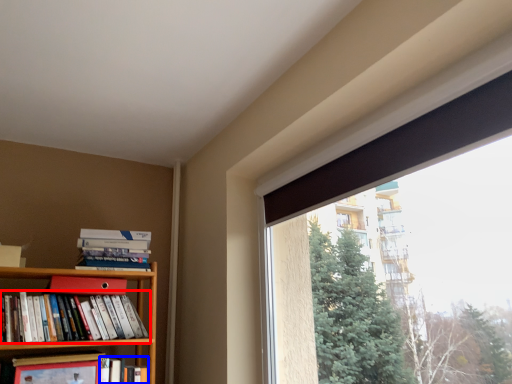
Question: Which object appears closest to the camera in this image, book (highlighted by a red box) or book (highlighted by a blue box)?

Choices:
 (A) book
 (B) book

Answer: (A)